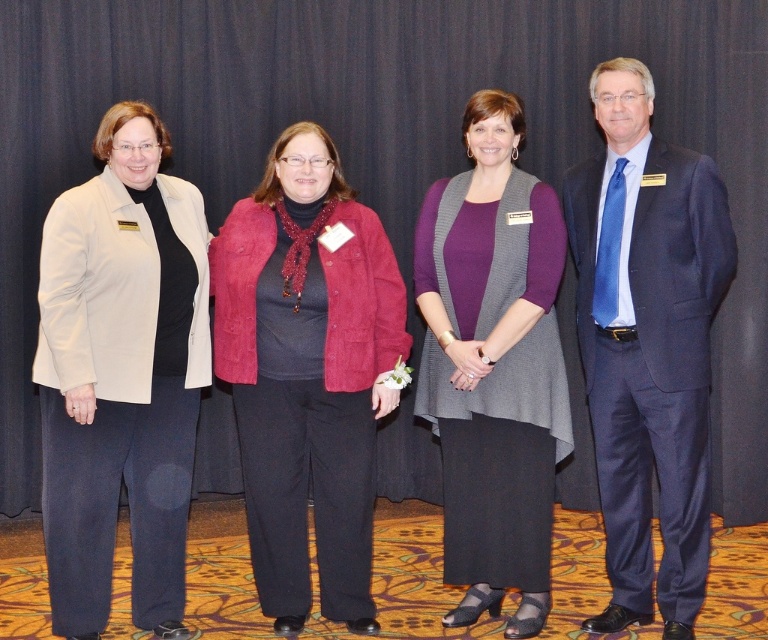
Question: Is suede-like red jacket at center to the left of knit gray vest at center from the viewer's perspective?

Choices:
 (A) no
 (B) yes

Answer: (B)

Question: Does suede-like red jacket at center appear on the right side of knit gray vest at center?

Choices:
 (A) yes
 (B) no

Answer: (B)

Question: Can you confirm if suede-like red jacket at center is wider than navy blue suit at right?

Choices:
 (A) yes
 (B) no

Answer: (A)

Question: Which point appears closest to the camera in this image?

Choices:
 (A) (88, 451)
 (B) (295, 449)
 (C) (598, 65)

Answer: (A)

Question: Which point is farther to the camera?

Choices:
 (A) navy blue suit at right
 (B) knit gray vest at center
 (C) beige fabric jacket at left

Answer: (B)

Question: Considering the real-world distances, which object is closest to the suede-like red jacket at center?

Choices:
 (A) navy blue suit at right
 (B) beige fabric jacket at left
 (C) knit gray vest at center

Answer: (B)